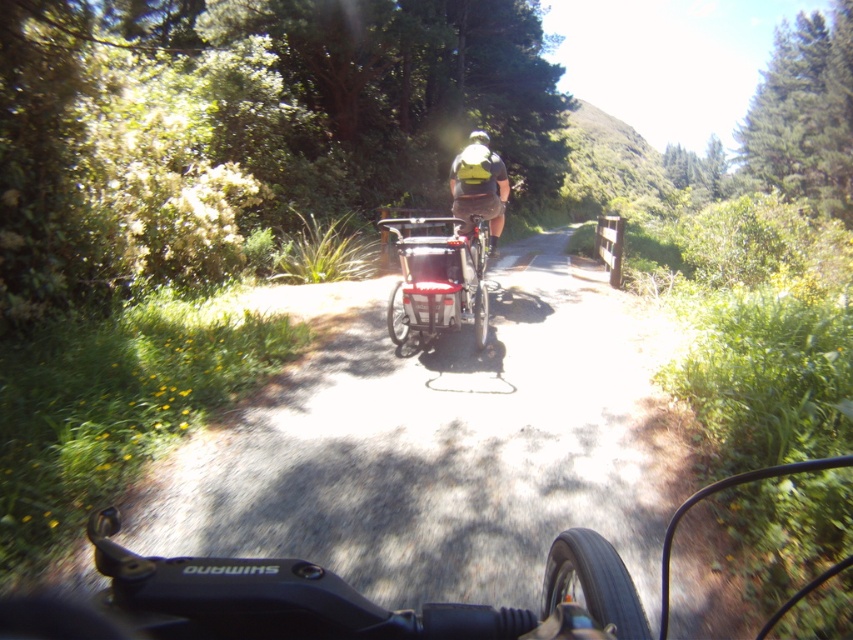
Question: Estimate the real-world distances between objects in this image. Which object is closer to the smooth asphalt road at center?

Choices:
 (A) yellow fabric backpack at center
 (B) metallic silver bicycle at center
 (C) white matte bicycle helmet at upper center

Answer: (B)

Question: Observing the image, what is the correct spatial positioning of smooth asphalt road at center in reference to white matte bicycle helmet at upper center?

Choices:
 (A) above
 (B) below

Answer: (B)

Question: Which is nearer to the smooth asphalt road at center?

Choices:
 (A) white matte bicycle helmet at upper center
 (B) yellow fabric backpack at center

Answer: (B)

Question: Can you confirm if smooth asphalt road at center is wider than white matte bicycle helmet at upper center?

Choices:
 (A) no
 (B) yes

Answer: (B)

Question: Estimate the real-world distances between objects in this image. Which object is closer to the smooth asphalt road at center?

Choices:
 (A) metallic silver bicycle at center
 (B) yellow fabric backpack at center
 (C) white matte bicycle helmet at upper center

Answer: (A)

Question: Does metallic silver bicycle at center appear on the left side of white matte bicycle helmet at upper center?

Choices:
 (A) no
 (B) yes

Answer: (B)